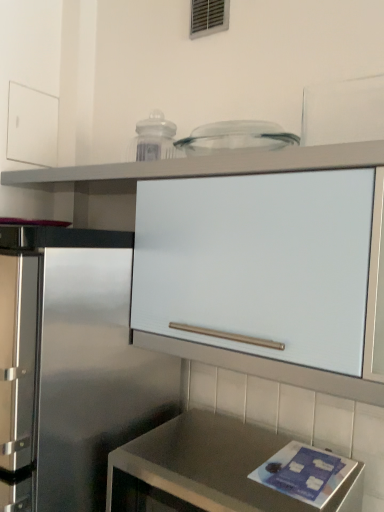
Question: Could you tell me if white matte cabinet at upper center is turned towards metallic vent at upper center?

Choices:
 (A) no
 (B) yes

Answer: (A)

Question: Is white matte cabinet at upper center oriented away from metallic vent at upper center?

Choices:
 (A) yes
 (B) no

Answer: (B)

Question: Considering the relative sizes of white matte cabinet at upper center and metallic vent at upper center in the image provided, is white matte cabinet at upper center taller than metallic vent at upper center?

Choices:
 (A) no
 (B) yes

Answer: (B)

Question: Can you confirm if white matte cabinet at upper center is positioned to the left of metallic vent at upper center?

Choices:
 (A) yes
 (B) no

Answer: (A)

Question: Can we say white matte cabinet at upper center lies outside metallic vent at upper center?

Choices:
 (A) no
 (B) yes

Answer: (B)

Question: In terms of height, does white matte drawer at upper left look taller or shorter compared to satin metallic countertop at lower center?

Choices:
 (A) short
 (B) tall

Answer: (A)

Question: Is white matte drawer at upper left situated inside satin metallic countertop at lower center or outside?

Choices:
 (A) inside
 (B) outside

Answer: (B)

Question: Visually, is white matte drawer at upper left positioned to the left or to the right of satin metallic countertop at lower center?

Choices:
 (A) left
 (B) right

Answer: (A)

Question: From a real-world perspective, is white matte drawer at upper left positioned above or below satin metallic countertop at lower center?

Choices:
 (A) below
 (B) above

Answer: (B)

Question: Based on their positions, is white matte cabinet at upper center located to the left or right of white matte drawer at upper left?

Choices:
 (A) left
 (B) right

Answer: (B)

Question: Based on their sizes in the image, would you say white matte cabinet at upper center is bigger or smaller than white matte drawer at upper left?

Choices:
 (A) small
 (B) big

Answer: (B)

Question: From a real-world perspective, is white matte cabinet at upper center physically located above or below white matte drawer at upper left?

Choices:
 (A) above
 (B) below

Answer: (B)

Question: From the image's perspective, is white matte cabinet at upper center located above or below white matte drawer at upper left?

Choices:
 (A) above
 (B) below

Answer: (B)

Question: Considering the positions of white matte drawer at upper left and metallic vent at upper center in the image, is white matte drawer at upper left taller or shorter than metallic vent at upper center?

Choices:
 (A) tall
 (B) short

Answer: (A)

Question: Looking at the image, does white matte drawer at upper left seem bigger or smaller compared to metallic vent at upper center?

Choices:
 (A) big
 (B) small

Answer: (A)